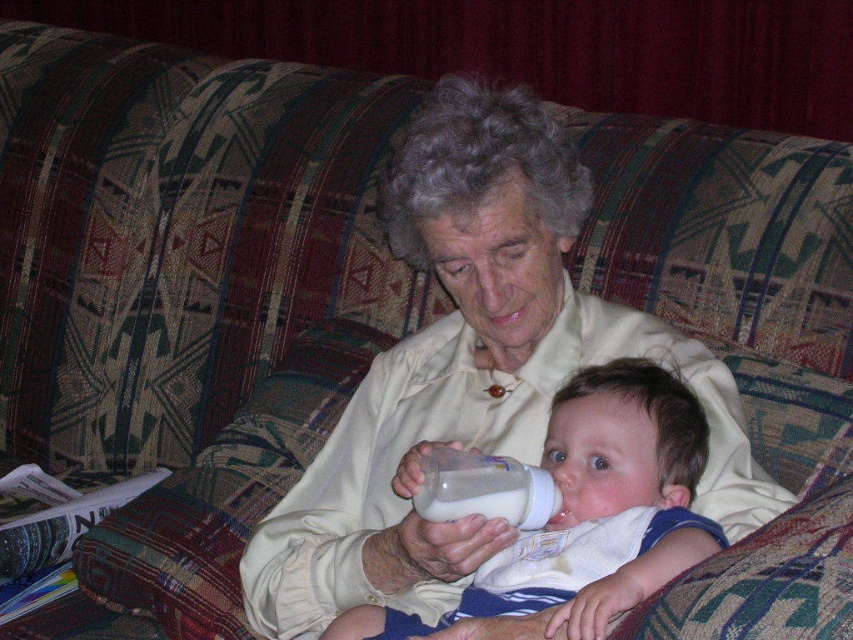
From the picture: Between white cotton bib at center and white plastic baby bottle at center, which one is positioned higher?

white plastic baby bottle at center is higher up.

Can you confirm if white cotton bib at center is positioned above white plastic baby bottle at center?

Incorrect, white cotton bib at center is not positioned above white plastic baby bottle at center.

Image resolution: width=853 pixels, height=640 pixels. In order to click on white cotton bib at center in this screenshot , I will do `click(590, 513)`.